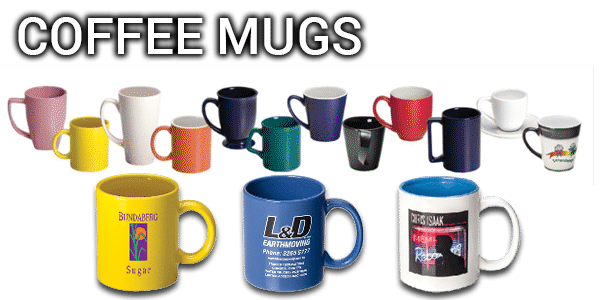
Where is `pink mug`? This screenshot has height=300, width=600. pink mug is located at coordinates (43, 113).